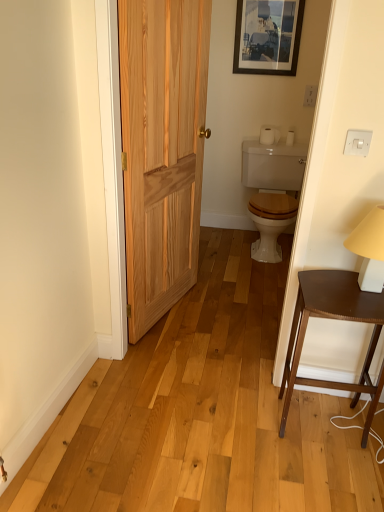
I want to click on free space underneath natural wood door at left (from a real-world perspective), so click(x=174, y=313).